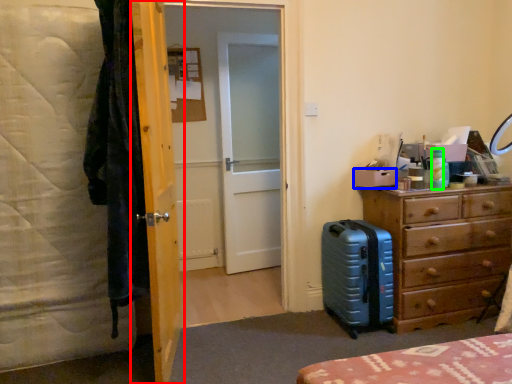
Question: Estimate the real-world distances between objects in this image. Which object is closer to door (highlighted by a red box), box (highlighted by a blue box) or bottle (highlighted by a green box)?

Choices:
 (A) box
 (B) bottle

Answer: (A)